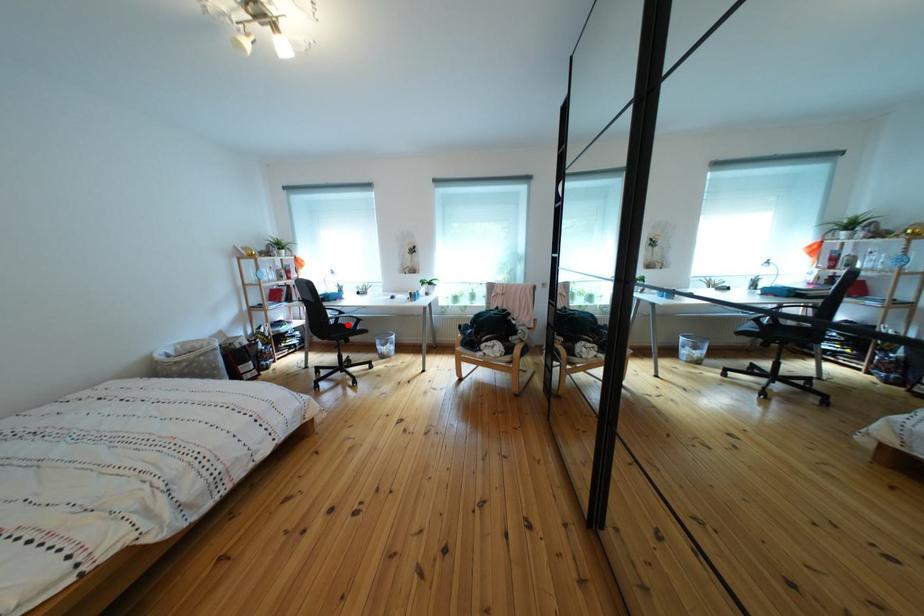
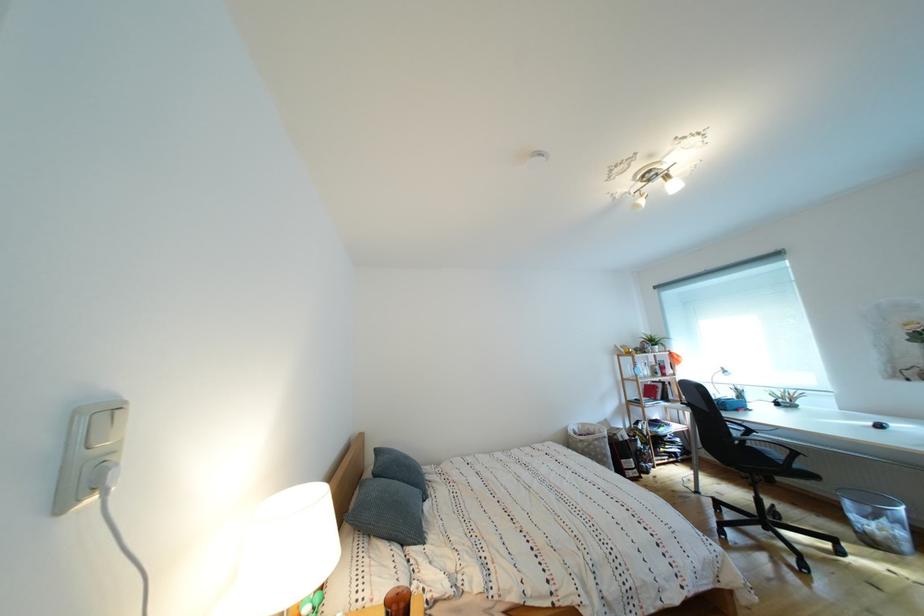
Find the pixel in the second image that matches the highlighted location in the first image.

(756, 446)